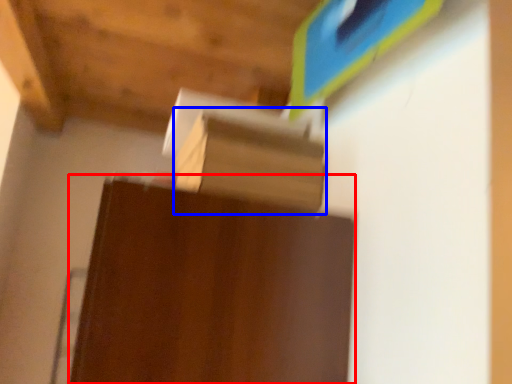
Question: Which object appears closest to the camera in this image, furniture (highlighted by a red box) or cardboard box (highlighted by a blue box)?

Choices:
 (A) furniture
 (B) cardboard box

Answer: (A)